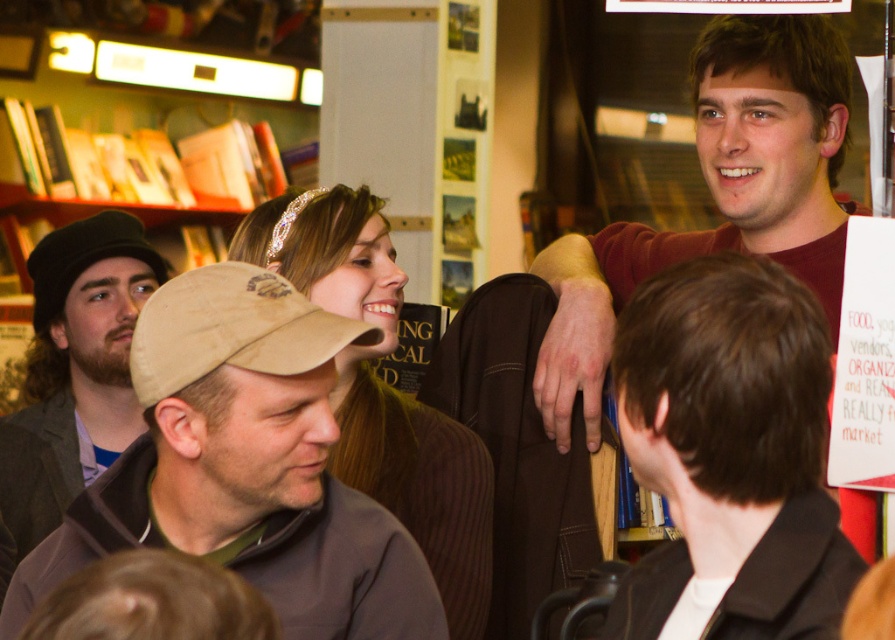
You are trying to decide which accessory to wear for a casual evening out. You have a shiny silver headband at upper center and a brown woolen cap at left. Based on their sizes, which one would you choose if you want something wider?

The shiny silver headband at upper center might be wider than brown woolen cap at left, so you should choose the shiny silver headband at upper center if you want something wider.

You are a store employee who needs to place both the brown fleece cap at center and the tan fabric baseball cap at center on a shelf that can only hold one large item or two small items. Based on their sizes, which one should you place first?

The brown fleece cap at center is larger in size than the tan fabric baseball cap at center, so you should place the brown fleece cap at center first since the shelf can only hold one large item or two small items.